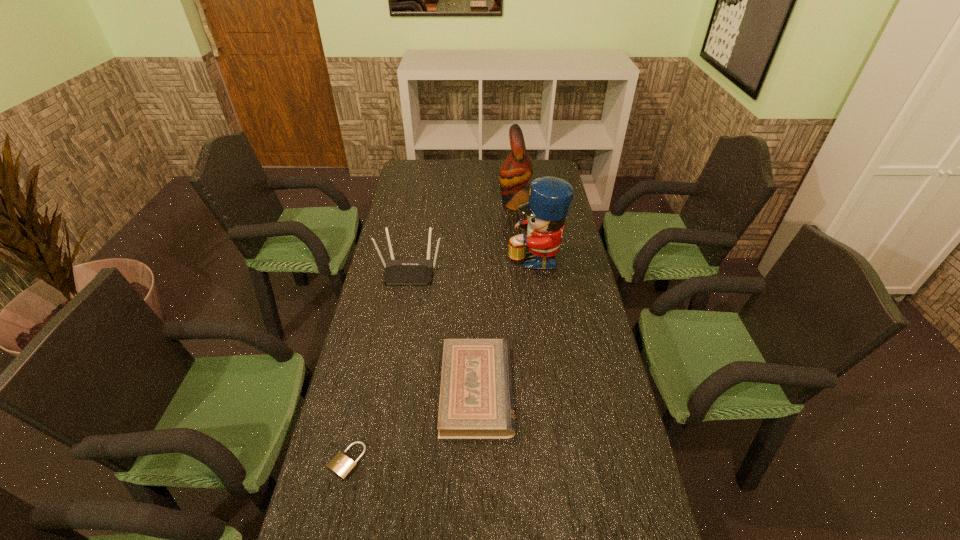
Locate an element on the screen. This screenshot has width=960, height=540. blank area at the far edge is located at coordinates (482, 163).

The width and height of the screenshot is (960, 540). In the image, there is a desktop. Find the location of `free space at the left edge`. free space at the left edge is located at coordinates (374, 499).

Identify the location of vacant space at the right edge of the desktop. (568, 268).

This screenshot has height=540, width=960. What are the coordinates of `free space at the far left corner` in the screenshot? It's located at (409, 183).

The height and width of the screenshot is (540, 960). What are the coordinates of `free space between the parrot and the fourth tallest object` in the screenshot? It's located at (496, 296).

The image size is (960, 540). In order to click on unoccupied area between the Bible and the nearest object in this screenshot , I will do coord(412,426).

Image resolution: width=960 pixels, height=540 pixels. I want to click on empty space between the third tallest object and the nutcracker, so click(x=472, y=264).

I want to click on free space between the nutcracker and the second shortest object, so click(506, 323).

Where is `free space that is in between the padlock and the farthest object`? free space that is in between the padlock and the farthest object is located at coordinates (432, 332).

The width and height of the screenshot is (960, 540). In order to click on vacant space in between the Bible and the parrot in this screenshot , I will do `click(496, 296)`.